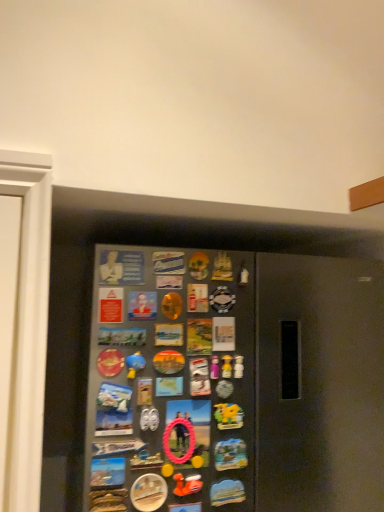
Measure the distance between point (145, 507) and camera.

Point (145, 507) is 36.42 inches from camera.

This screenshot has height=512, width=384. I want to click on metallic button at center, acting as the 2th button starting from the top, so click(x=142, y=305).

This screenshot has height=512, width=384. In order to click on pink rubber ring at center, marked as the 3th button in a top-to-bottom arrangement in this screenshot , I will do `click(188, 430)`.

Measure the distance between point (x=229, y=376) and camera.

Point (x=229, y=376) and camera are 1.01 meters apart.

Describe the element at coordinates (152, 244) in the screenshot. I see `metallic gray fridge at center` at that location.

Measure the distance between matte plastic magnet at center, which appears as the 4th button when viewed from the top, and camera.

98.10 centimeters.

The width and height of the screenshot is (384, 512). I want to click on metallic silver button at lower center, which ranks as the 1th button in bottom-to-top order, so pos(148,492).

From the image's perspective, is metallic button at center, the 5th button when ordered from bottom to top, located above or below rubber duck at center?

metallic button at center, the 5th button when ordered from bottom to top, is situated higher than rubber duck at center in the image.

Which object is closer to the camera taking this photo, metallic button at center, the 5th button when ordered from bottom to top, or rubber duck at center?

metallic button at center, the 5th button when ordered from bottom to top, is in front.

Could you tell me if metallic button at center, the 5th button when ordered from bottom to top, is facing rubber duck at center?

No, metallic button at center, the 5th button when ordered from bottom to top, does not turn towards rubber duck at center.

Would you say metallic button at center, acting as the 2th button starting from the top, is outside rubber duck at center?

metallic button at center, acting as the 2th button starting from the top, is positioned outside rubber duck at center.

Do you think metallic button at center, the 5th button when ordered from bottom to top, is within matte plastic magnet at center, which appears as the 4th button when viewed from the top, or outside of it?

metallic button at center, the 5th button when ordered from bottom to top, lies outside matte plastic magnet at center, which appears as the 4th button when viewed from the top.

Consider the image. Can you confirm if metallic button at center, the 5th button when ordered from bottom to top, is smaller than matte plastic magnet at center, which appears as the 4th button when viewed from the top?

Indeed, metallic button at center, the 5th button when ordered from bottom to top, has a smaller size compared to matte plastic magnet at center, which appears as the 4th button when viewed from the top.

From the image's perspective, would you say metallic button at center, acting as the 2th button starting from the top, is positioned over matte plastic magnet at center, which is the third button from bottom to top?

Yes, from the image's perspective, metallic button at center, acting as the 2th button starting from the top, is above matte plastic magnet at center, which is the third button from bottom to top.

Is metallic button at center, acting as the 2th button starting from the top, far from matte plastic magnet at center, which is the third button from bottom to top?

They are positioned close to each other.

Which is closer to the camera, (92,477) or (196,403)?

Point (92,477) is closer to the camera than point (196,403).

Considering the sizes of objects metallic blue magnet at lower left, which ranks as the second button in bottom-to-top order, and pink rubber ring at center, positioned as the 4th button in bottom-to-top order, in the image provided, who is wider, metallic blue magnet at lower left, which ranks as the second button in bottom-to-top order, or pink rubber ring at center, positioned as the 4th button in bottom-to-top order,?

metallic blue magnet at lower left, which ranks as the second button in bottom-to-top order, is wider.

From the image's perspective, between metallic blue magnet at lower left, which ranks as the second button in bottom-to-top order, and pink rubber ring at center, positioned as the 4th button in bottom-to-top order, who is located below?

From the image's view, metallic blue magnet at lower left, which ranks as the second button in bottom-to-top order, is below.

Could pink rubber ring at center, positioned as the 4th button in bottom-to-top order, be considered to be inside metallic blue magnet at lower left, which ranks as the second button in bottom-to-top order?

No, pink rubber ring at center, positioned as the 4th button in bottom-to-top order, is not inside metallic blue magnet at lower left, which ranks as the second button in bottom-to-top order.

Would you say metallic blue magnet at lower left, which ranks as the second button in bottom-to-top order, is part of metallic gray fridge at center's contents?

Yes, metallic blue magnet at lower left, which ranks as the second button in bottom-to-top order, is a part of metallic gray fridge at center.

What's the angular difference between metallic gray fridge at center and metallic blue magnet at lower left, placed as the fifth button when sorted from top to bottom,'s facing directions?

There is a 7.35-degree angle between the facing directions of metallic gray fridge at center and metallic blue magnet at lower left, placed as the fifth button when sorted from top to bottom.

Considering the sizes of metallic gray fridge at center and metallic blue magnet at lower left, placed as the fifth button when sorted from top to bottom, in the image, is metallic gray fridge at center taller or shorter than metallic blue magnet at lower left, placed as the fifth button when sorted from top to bottom,?

Considering their sizes, metallic gray fridge at center has more height than metallic blue magnet at lower left, placed as the fifth button when sorted from top to bottom.

Considering the sizes of objects metallic gray fridge at center and metallic blue magnet at lower left, placed as the fifth button when sorted from top to bottom, in the image provided, who is thinner, metallic gray fridge at center or metallic blue magnet at lower left, placed as the fifth button when sorted from top to bottom,?

metallic blue magnet at lower left, placed as the fifth button when sorted from top to bottom, is thinner.

Considering the relative positions of matte plastic bust at upper center, positioned as the 6th button in bottom-to-top order, and rubber duck at lower center in the image provided, is matte plastic bust at upper center, positioned as the 6th button in bottom-to-top order, to the right of rubber duck at lower center from the viewer's perspective?

No, matte plastic bust at upper center, positioned as the 6th button in bottom-to-top order, is not to the right of rubber duck at lower center.

Does point (143, 265) lie in front of point (177, 494)?

That is False.

Looking at this image, considering the sizes of matte plastic bust at upper center, positioned as the 6th button in bottom-to-top order, and rubber duck at lower center in the image, is matte plastic bust at upper center, positioned as the 6th button in bottom-to-top order, wider or thinner than rubber duck at lower center?

matte plastic bust at upper center, positioned as the 6th button in bottom-to-top order, is thinner than rubber duck at lower center.

Looking at this image, between matte plastic bust at upper center, positioned as the 6th button in bottom-to-top order, and rubber duck at lower center, which one has less height?

rubber duck at lower center is shorter.

Can rubber duck at lower center be found inside metallic blue magnet at lower left, which ranks as the second button in bottom-to-top order?

That's incorrect, rubber duck at lower center is not inside metallic blue magnet at lower left, which ranks as the second button in bottom-to-top order.

Image resolution: width=384 pixels, height=512 pixels. Find the location of `the 5th button to the left of the rubber duck at lower center, counting from the anchor's position`. the 5th button to the left of the rubber duck at lower center, counting from the anchor's position is located at coordinates (107, 472).

Which is behind, point (111, 485) or point (182, 487)?

The point (182, 487) is behind.

Does pink rubber ring at center, positioned as the 4th button in bottom-to-top order, have a greater width compared to metallic button at center, acting as the 2th button starting from the top?

No.

Which of these two, pink rubber ring at center, marked as the 3th button in a top-to-bottom arrangement, or metallic button at center, the 5th button when ordered from bottom to top, is smaller?

metallic button at center, the 5th button when ordered from bottom to top, is smaller.

From the image's perspective, is pink rubber ring at center, marked as the 3th button in a top-to-bottom arrangement, located above or below metallic button at center, the 5th button when ordered from bottom to top?

From the image's perspective, pink rubber ring at center, marked as the 3th button in a top-to-bottom arrangement, appears below metallic button at center, the 5th button when ordered from bottom to top.

The image size is (384, 512). What are the coordinates of `toy behind the metallic button at center, the 5th button when ordered from bottom to top` in the screenshot? It's located at (227, 366).

Image resolution: width=384 pixels, height=512 pixels. I want to click on the 3rd button to the right of the metallic button at center, acting as the 2th button starting from the top, starting your count from the anchor, so click(x=230, y=455).

Looking at the image, which one is located further to matte plastic bust at upper center, marked as the 1th button in a top-to-bottom arrangement, rubber duck at center or metallic silver button at lower center, which ranks as the 1th button in bottom-to-top order?

metallic silver button at lower center, which ranks as the 1th button in bottom-to-top order.

Looking at the image, which one is located further to pink rubber ring at center, marked as the 3th button in a top-to-bottom arrangement, matte plastic bust at upper center, marked as the 1th button in a top-to-bottom arrangement, or matte plastic magnet at center, which appears as the 4th button when viewed from the top?

matte plastic bust at upper center, marked as the 1th button in a top-to-bottom arrangement, is positioned further to the anchor pink rubber ring at center, marked as the 3th button in a top-to-bottom arrangement.

From the image, which object appears to be farther from pink rubber ring at center, marked as the 3th button in a top-to-bottom arrangement, metallic gray fridge at center or matte plastic magnet at center, which is the third button from bottom to top?

metallic gray fridge at center is positioned further to the anchor pink rubber ring at center, marked as the 3th button in a top-to-bottom arrangement.

Estimate the real-world distances between objects in this image. Which object is further from rubber duck at lower center, metallic silver button at lower center, which appears as the sixth button when viewed from the top, or matte plastic magnet at center, which appears as the 4th button when viewed from the top?

matte plastic magnet at center, which appears as the 4th button when viewed from the top, is further to rubber duck at lower center.

From the image, which object appears to be nearer to metallic gray fridge at center, metallic button at center, the 5th button when ordered from bottom to top, or rubber duck at lower center?

Based on the image, metallic button at center, the 5th button when ordered from bottom to top, appears to be nearer to metallic gray fridge at center.

Based on their spatial positions, is metallic silver button at lower center, which appears as the sixth button when viewed from the top, or pink rubber ring at center, marked as the 3th button in a top-to-bottom arrangement, closer to rubber duck at center?

pink rubber ring at center, marked as the 3th button in a top-to-bottom arrangement, is positioned closer to the anchor rubber duck at center.

Based on their spatial positions, is metallic gray fridge at center or matte plastic magnet at center, which appears as the 4th button when viewed from the top, further from matte plastic bust at upper center, marked as the 1th button in a top-to-bottom arrangement?

The object further to matte plastic bust at upper center, marked as the 1th button in a top-to-bottom arrangement, is metallic gray fridge at center.

Estimate the real-world distances between objects in this image. Which object is closer to metallic blue magnet at lower left, which ranks as the second button in bottom-to-top order, matte plastic bust at upper center, positioned as the 6th button in bottom-to-top order, or rubber duck at lower center?

Based on the image, rubber duck at lower center appears to be nearer to metallic blue magnet at lower left, which ranks as the second button in bottom-to-top order.

The width and height of the screenshot is (384, 512). In order to click on button between rubber duck at center and matte plastic magnet at center, which appears as the 4th button when viewed from the top, from top to bottom in this screenshot , I will do `click(188, 430)`.

Identify the location of art between metallic blue magnet at lower left, which ranks as the second button in bottom-to-top order, and rubber duck at center, in the horizontal direction. This screenshot has height=512, width=384. (187, 484).

Find the location of a particular element. The width and height of the screenshot is (384, 512). toy between metallic button at center, acting as the 2th button starting from the top, and rubber duck at lower center in the up-down direction is located at coordinates (227, 366).

Identify the location of art situated between metallic blue magnet at lower left, which ranks as the second button in bottom-to-top order, and matte plastic magnet at center, which appears as the 4th button when viewed from the top, from left to right. This screenshot has height=512, width=384. (187, 484).